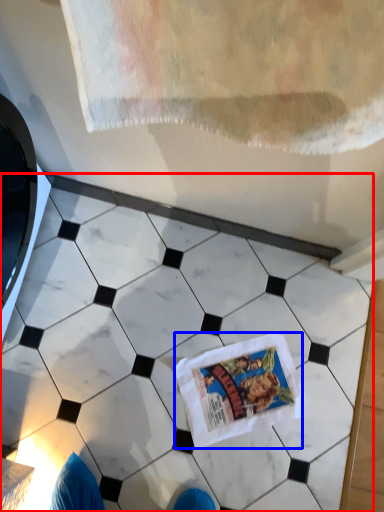
Question: Which object appears farthest to the camera in this image, marble (highlighted by a red box) or comic book (highlighted by a blue box)?

Choices:
 (A) marble
 (B) comic book

Answer: (B)